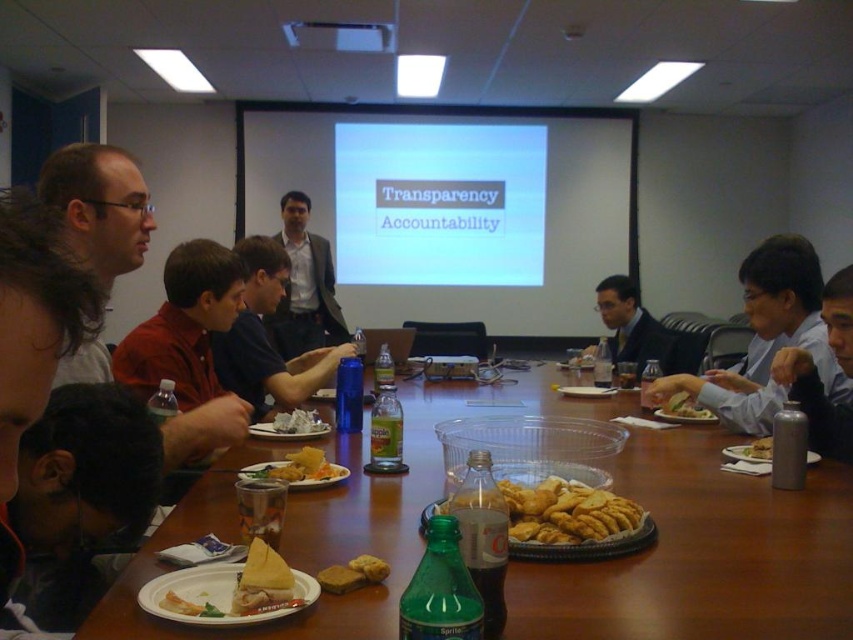
You are a server in a meeting room. You need to place a new plate of food on the table without covering any existing items. The table has the matte gray suit at center and the golden crispy bread at center. Which object should you avoid placing the new plate over?

You should avoid placing the new plate over the golden crispy bread at center because the matte gray suit at center is already positioned over it, meaning the bread is underneath and likely not visible or accessible.

You are a person sitting at the meeting table and want to reach both the point at (692, 401) and the point at (747, 456). Which point is closer to you?

The point at (692, 401) is closer to you because it is further to the viewer than the point at (747, 456).

You are a meeting attendee who just noticed crumbs on your table. You see the shiny plastic container at center and the brown crumbly cookie at center. Which object is closer to the ceiling?

The shiny plastic container at center is above the brown crumbly cookie at center, so it is closer to the ceiling.